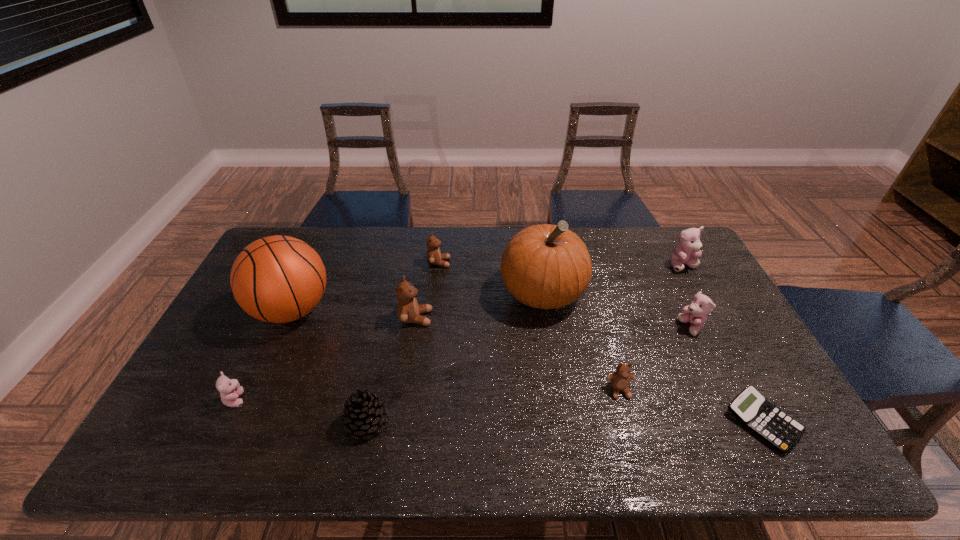
Identify the location of the leftmost teddy bear. Image resolution: width=960 pixels, height=540 pixels. (230, 389).

This screenshot has width=960, height=540. In order to click on the shortest object in this screenshot , I will do `click(751, 408)`.

The height and width of the screenshot is (540, 960). What are the coordinates of `free space located 0.330m on the stem of the orange pumpkin` in the screenshot? It's located at (564, 427).

I want to click on vacant space located 0.130m on the front of the basketball, so click(261, 380).

Where is `free space located 0.180m at the face of the farthest pink teddy bear`? This screenshot has width=960, height=540. free space located 0.180m at the face of the farthest pink teddy bear is located at coordinates (708, 313).

Find the location of a particular element. free space located on the front-facing side of the biggest brown teddy bear is located at coordinates (545, 318).

This screenshot has width=960, height=540. In order to click on free region located 0.200m on the front-facing side of the farthest brown teddy bear in this screenshot , I will do `click(508, 263)`.

Where is `free spot located 0.340m at the face of the second farthest pink teddy bear`? This screenshot has width=960, height=540. free spot located 0.340m at the face of the second farthest pink teddy bear is located at coordinates (564, 327).

Image resolution: width=960 pixels, height=540 pixels. Find the location of `blank space located at the face of the second farthest pink teddy bear`. blank space located at the face of the second farthest pink teddy bear is located at coordinates (625, 327).

Where is `vacant space situated at the face of the second farthest pink teddy bear`? vacant space situated at the face of the second farthest pink teddy bear is located at coordinates (570, 327).